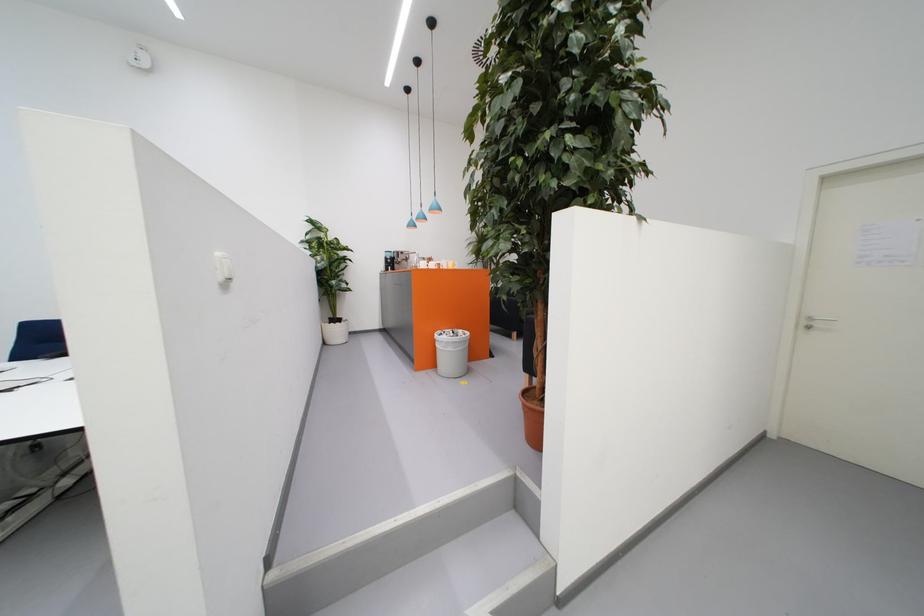
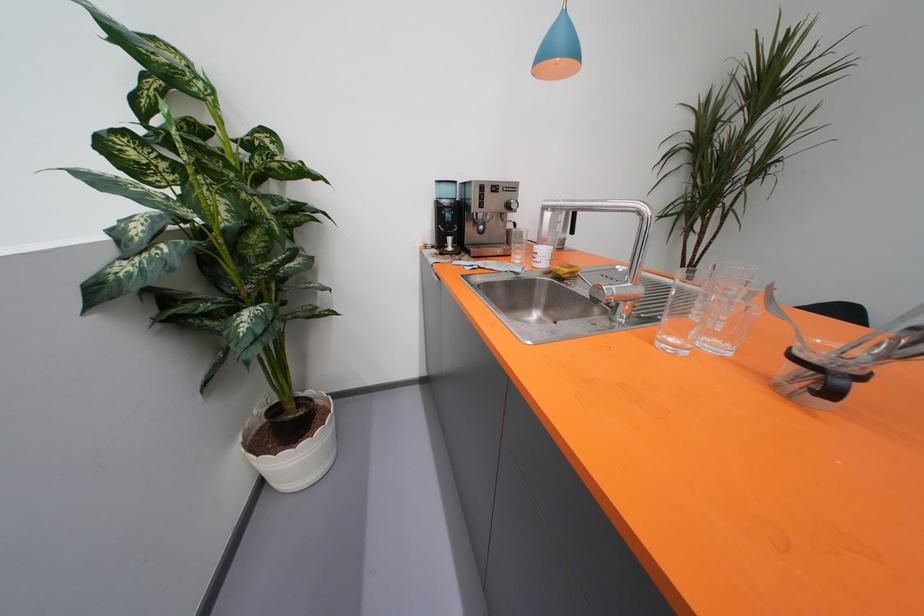
Question: The images are taken continuously from a first-person perspective. In which direction are you moving?

Choices:
 (A) Left
 (B) Right
 (C) Forward
 (D) Backward

Answer: (C)